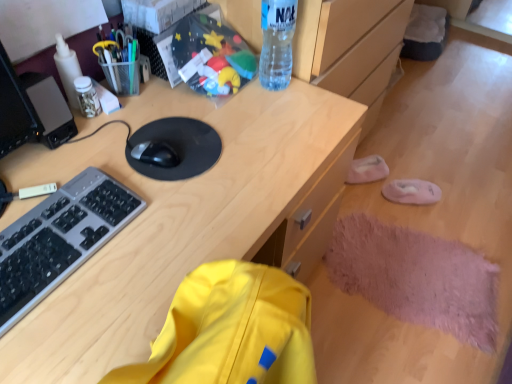
You are a GUI agent. You are given a task and a screenshot of the screen. Output one action in this format:
    pyautogui.click(x=<x>, y=<y>)
    Task: Click on the free space to the right of translucent plastic jar at upper left, which is counted as the 2th stationery, starting from the right
    Image resolution: width=512 pixels, height=384 pixels.
    Given the screenshot: What is the action you would take?
    pyautogui.click(x=152, y=109)